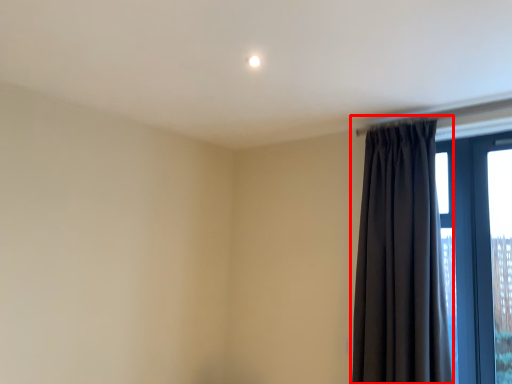
Question: From the image, what is the correct spatial relationship of curtain (annotated by the red box) in relation to window?

Choices:
 (A) left
 (B) right

Answer: (A)